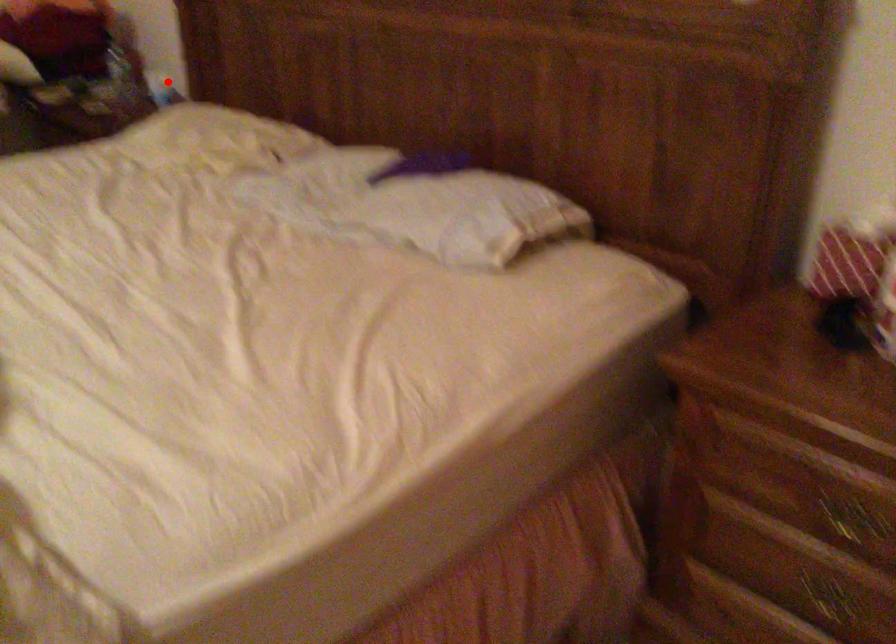
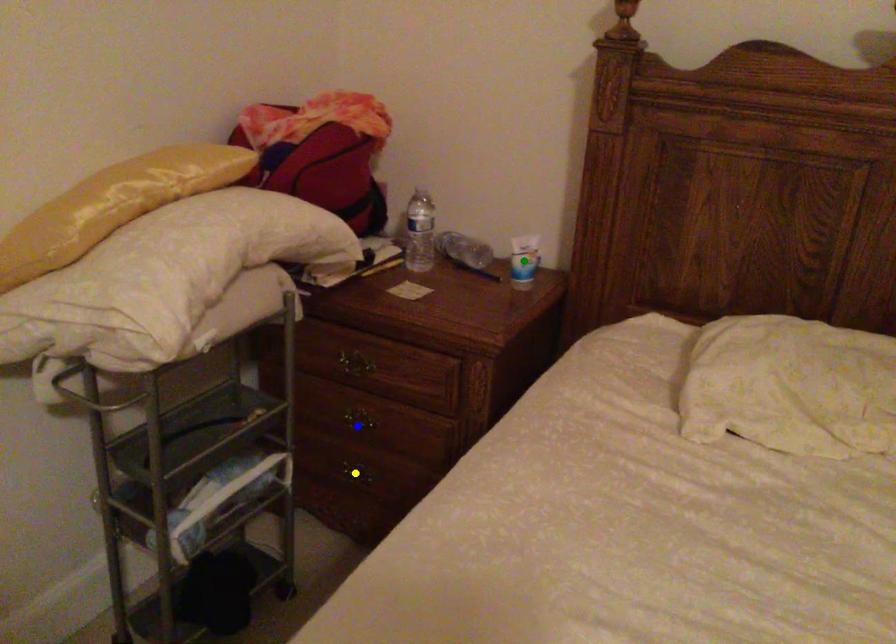
Question: I am providing you with two images of the same scene from different viewpoints. A red point is marked on the first image. You are given multiple points on the second image. Which point in image 2 is actually the same real-world point as the red point in image 1?

Choices:
 (A) blue point
 (B) green point
 (C) yellow point

Answer: (B)